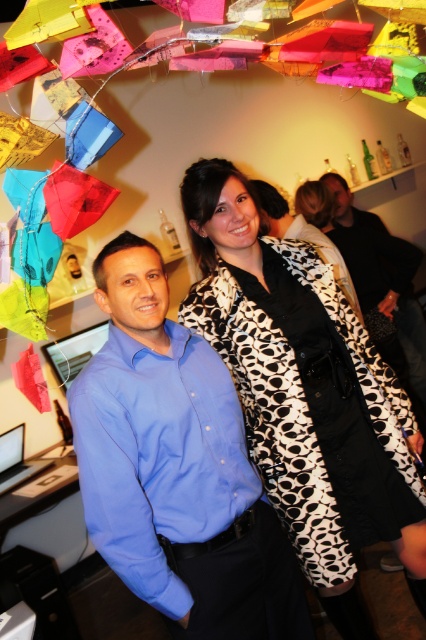
Question: Which point is farther to the camera?

Choices:
 (A) (233, 376)
 (B) (402, 328)
 (C) (313, 228)

Answer: (B)

Question: Is black and white dotted coat at center closer to the viewer compared to blue smooth shirt at center?

Choices:
 (A) yes
 (B) no

Answer: (B)

Question: Can you confirm if black and white dotted coat at center is positioned to the right of blue shirt at center?

Choices:
 (A) no
 (B) yes

Answer: (A)

Question: Which point is farther from the camera taking this photo?

Choices:
 (A) (281, 195)
 (B) (396, 186)

Answer: (B)

Question: Does black and white dotted coat at center lie behind blue shirt at center?

Choices:
 (A) yes
 (B) no

Answer: (B)

Question: Which point is closer to the camera?

Choices:
 (A) dark brown leather jacket at upper right
 (B) black and white dotted coat at center

Answer: (B)